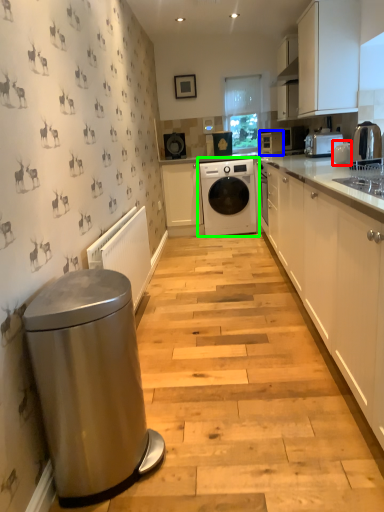
Question: Which is nearer to the appliance (highlighted by a red box)? appliance (highlighted by a blue box) or washing machine (highlighted by a green box).

Choices:
 (A) appliance
 (B) washing machine

Answer: (A)